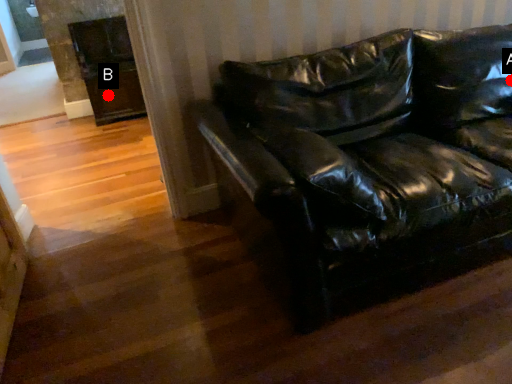
Question: Two points are circled on the image, labeled by A and B beside each circle. Which point is farther to the camera?

Choices:
 (A) A is further
 (B) B is further

Answer: (B)